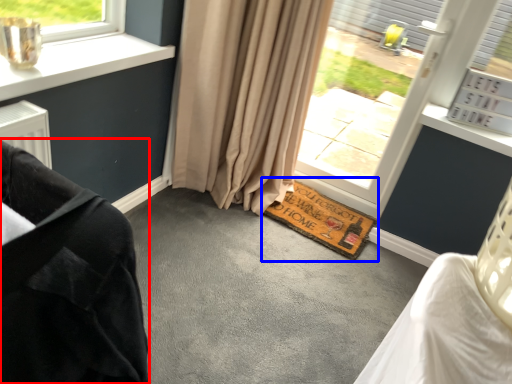
Question: Among these objects, which one is nearest to the camera, furniture (highlighted by a red box) or doormat (highlighted by a blue box)?

Choices:
 (A) furniture
 (B) doormat

Answer: (A)